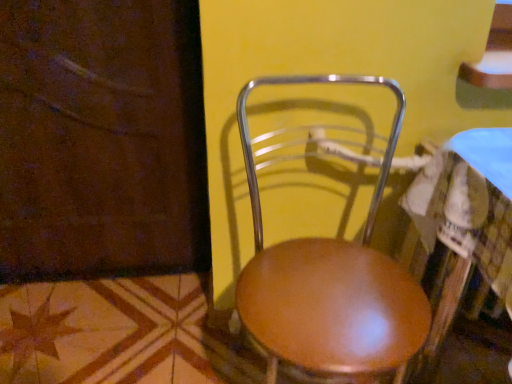
Question: Is wooden seat at center positioned far away from brown wood screen door at lower left?

Choices:
 (A) no
 (B) yes

Answer: (A)

Question: From a real-world perspective, is wooden seat at center physically above brown wood screen door at lower left?

Choices:
 (A) yes
 (B) no

Answer: (B)

Question: From the image's perspective, is wooden seat at center under brown wood screen door at lower left?

Choices:
 (A) yes
 (B) no

Answer: (A)

Question: Does wooden seat at center come behind brown wood screen door at lower left?

Choices:
 (A) yes
 (B) no

Answer: (B)

Question: Is wooden seat at center closer to the viewer compared to brown wood screen door at lower left?

Choices:
 (A) yes
 (B) no

Answer: (A)

Question: Is wooden seat at center thinner than brown wood screen door at lower left?

Choices:
 (A) no
 (B) yes

Answer: (A)

Question: Is wooden seat at center positioned with its back to shiny brown table at center?

Choices:
 (A) yes
 (B) no

Answer: (B)

Question: Would you say wooden seat at center is a long distance from shiny brown table at center?

Choices:
 (A) no
 (B) yes

Answer: (A)

Question: Can you confirm if wooden seat at center is thinner than shiny brown table at center?

Choices:
 (A) no
 (B) yes

Answer: (B)

Question: From a real-world perspective, is wooden seat at center on top of shiny brown table at center?

Choices:
 (A) yes
 (B) no

Answer: (A)

Question: Is wooden seat at center further to camera compared to shiny brown table at center?

Choices:
 (A) no
 (B) yes

Answer: (B)

Question: Could shiny brown table at center be considered to be inside wooden seat at center?

Choices:
 (A) no
 (B) yes

Answer: (A)

Question: From a real-world perspective, is brown wood screen door at lower left physically below shiny brown table at center?

Choices:
 (A) no
 (B) yes

Answer: (A)